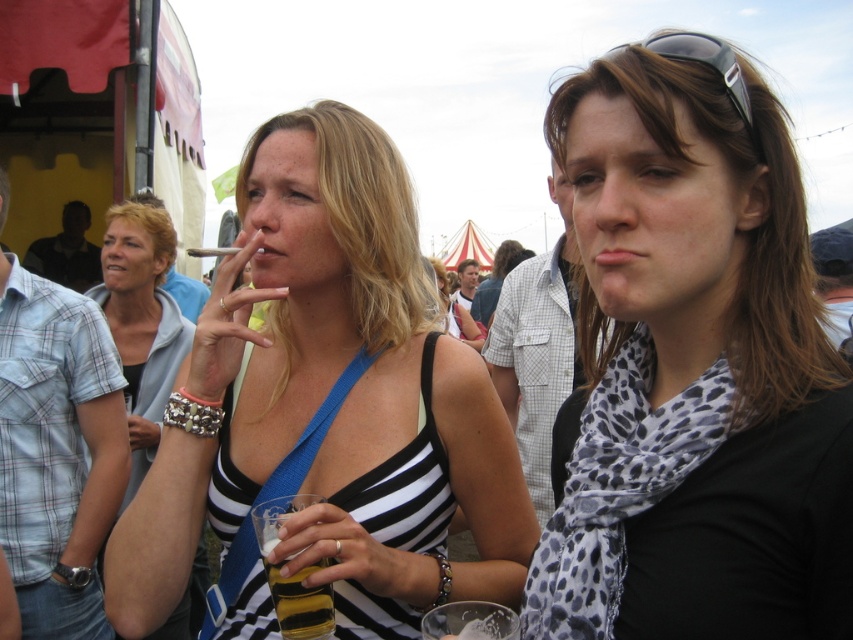
You are a photographer at the event and want to capture a photo that includes both the black and white striped tank top at center and the black plastic sunglasses at upper right. Which object should you focus on first to ensure both are in frame?

The black and white striped tank top at center is taller than the black plastic sunglasses at upper right, so you should focus on the black and white striped tank top at center first to ensure both are in frame.

Based on the scene description, where is the translucent yellow liquid at lower center located in the image?

The translucent yellow liquid at lower center is located at the 2D coordinates point (299, 600) in the image.

You are organizing a clothing donation drive and need to determine if the black plastic sunglasses at upper right can fit inside the black and white striped tank top at center. Based on their sizes, can the sunglasses fit inside the tank top?

The black and white striped tank top at center is bigger than the black plastic sunglasses at upper right, so yes, the sunglasses can fit inside the tank top.